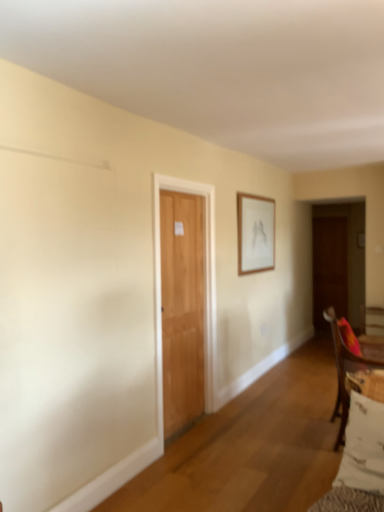
Question: Is wooden frame at upper center to the right of white cotton pillow at lower right from the viewer's perspective?

Choices:
 (A) yes
 (B) no

Answer: (A)

Question: Can you confirm if wooden frame at upper center is wider than white cotton pillow at lower right?

Choices:
 (A) no
 (B) yes

Answer: (A)

Question: Considering the relative sizes of wooden frame at upper center and white cotton pillow at lower right in the image provided, is wooden frame at upper center smaller than white cotton pillow at lower right?

Choices:
 (A) no
 (B) yes

Answer: (A)

Question: Is wooden frame at upper center thinner than white cotton pillow at lower right?

Choices:
 (A) no
 (B) yes

Answer: (B)

Question: Is the depth of wooden frame at upper center less than that of white cotton pillow at lower right?

Choices:
 (A) yes
 (B) no

Answer: (B)

Question: From the image's perspective, is wooden frame at upper center located beneath white cotton pillow at lower right?

Choices:
 (A) no
 (B) yes

Answer: (A)

Question: Is brown wooden door at right, the second door viewed from the front, inside white cotton pillow at lower right?

Choices:
 (A) yes
 (B) no

Answer: (B)

Question: From the image's perspective, does white cotton pillow at lower right appear higher than brown wooden door at right, the first door positioned from the back?

Choices:
 (A) no
 (B) yes

Answer: (A)

Question: From a real-world perspective, is white cotton pillow at lower right below brown wooden door at right, marked as the first door in a right-to-left arrangement?

Choices:
 (A) yes
 (B) no

Answer: (A)

Question: Can you confirm if white cotton pillow at lower right is smaller than brown wooden door at right, the second door viewed from the front?

Choices:
 (A) no
 (B) yes

Answer: (B)

Question: Is white cotton pillow at lower right positioned far away from brown wooden door at right, the second door viewed from the front?

Choices:
 (A) no
 (B) yes

Answer: (B)

Question: Is white cotton pillow at lower right looking in the opposite direction of brown wooden door at right, the first door positioned from the back?

Choices:
 (A) no
 (B) yes

Answer: (A)

Question: Is brown wooden door at right, which ranks as the 2th door in left-to-right order, to the left of wooden chair at lower right from the viewer's perspective?

Choices:
 (A) yes
 (B) no

Answer: (B)